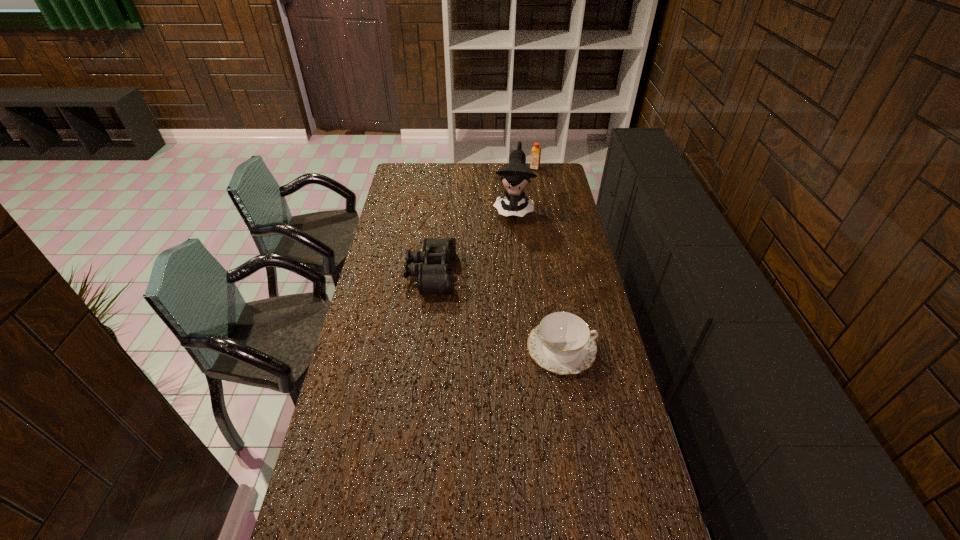
Locate an element on the screen. The width and height of the screenshot is (960, 540). free space between the third tallest object and the tallest object is located at coordinates (472, 241).

Find the location of a particular element. blank region between the leftmost object and the farthest object is located at coordinates point(483,221).

Locate an element on the screen. The width and height of the screenshot is (960, 540). empty space that is in between the tallest object and the shortest object is located at coordinates (538, 278).

Select which object is the closest to the doll. Please provide its 2D coordinates. Your answer should be formatted as a tuple, i.e. [(x, y)], where the tuple contains the x and y coordinates of a point satisfying the conditions above.

[(535, 158)]

I want to click on object that is the third nearest to the second tallest object, so click(562, 343).

This screenshot has width=960, height=540. I want to click on free space that satisfies the following two spatial constraints: 1. on the back side of the farthest object; 2. on the left side of the doll, so click(x=509, y=168).